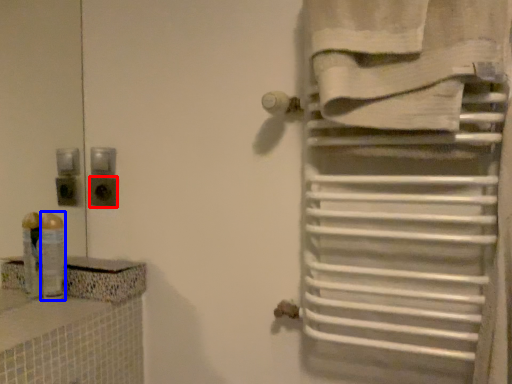
Question: Which object appears farthest to the camera in this image, electric outlet (highlighted by a red box) or toiletry (highlighted by a blue box)?

Choices:
 (A) electric outlet
 (B) toiletry

Answer: (A)